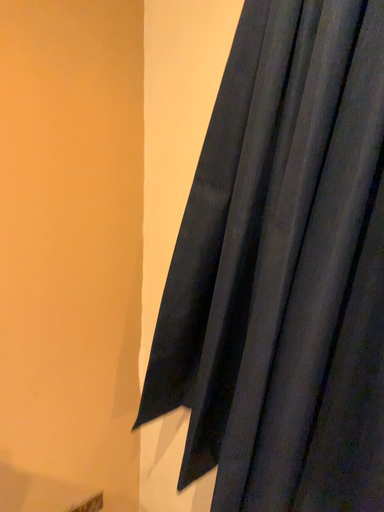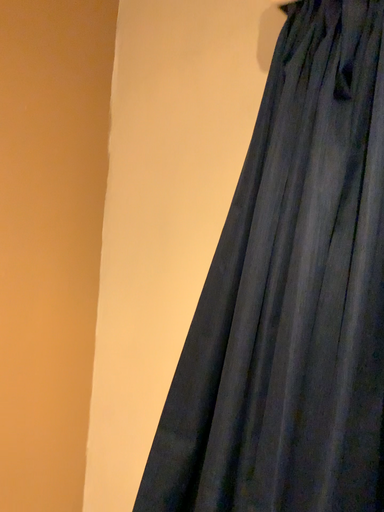
Question: How did the camera likely rotate when shooting the video?

Choices:
 (A) rotated left
 (B) rotated right

Answer: (B)